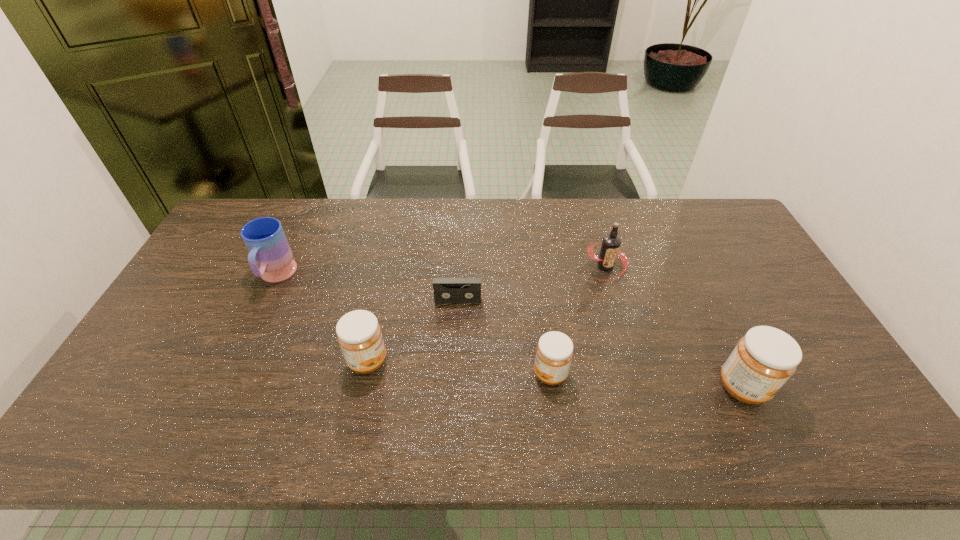
Where is `blank space at the far right corner of the desktop`? Image resolution: width=960 pixels, height=540 pixels. blank space at the far right corner of the desktop is located at coordinates (724, 221).

Find the location of `unoccupied area between the fifth tallest object and the fifth object from left to right`. unoccupied area between the fifth tallest object and the fifth object from left to right is located at coordinates (578, 320).

Locate an element on the screen. This screenshot has width=960, height=540. empty space between the second jam from left to right and the leftmost object is located at coordinates (413, 325).

Locate an element on the screen. This screenshot has width=960, height=540. free space between the second shortest jam and the fourth object from left to right is located at coordinates (459, 367).

Where is `vacant area between the leftmost jam and the mug`? The height and width of the screenshot is (540, 960). vacant area between the leftmost jam and the mug is located at coordinates (322, 319).

This screenshot has height=540, width=960. I want to click on free spot between the rightmost object and the leftmost object, so click(x=510, y=332).

Find the location of `unoccupied area between the fifth tallest object and the mug`. unoccupied area between the fifth tallest object and the mug is located at coordinates (413, 325).

The width and height of the screenshot is (960, 540). Find the location of `free space between the root beer and the leftmost jam`. free space between the root beer and the leftmost jam is located at coordinates (487, 314).

You are a GUI agent. You are given a task and a screenshot of the screen. Output one action in this format:
    pyautogui.click(x=<x>, y=<y>)
    Task: Click on the empty space between the shortest object and the fourth object from left to right
    The height and width of the screenshot is (540, 960).
    Given the screenshot: What is the action you would take?
    pyautogui.click(x=504, y=337)

This screenshot has height=540, width=960. Identify the location of empty location between the rightmost object and the shortest jam. (646, 381).